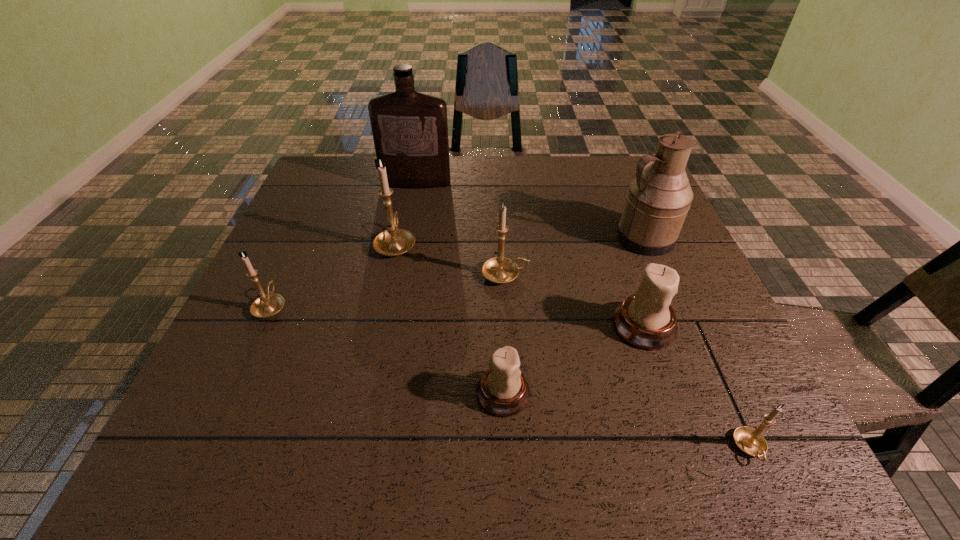
What are the coordinates of `the seventh farthest object` in the screenshot? It's located at (503, 391).

This screenshot has height=540, width=960. I want to click on the nearer white candle holder, so click(503, 391).

Identify the location of the rightmost gold candle holder. (751, 441).

I want to click on the nearest candle holder, so click(751, 441).

Locate an element on the screen. The image size is (960, 540). free location located 0.310m on the label side of the liquor is located at coordinates (401, 258).

This screenshot has height=540, width=960. In order to click on free space located 0.280m on the left of the pitcher in this screenshot , I will do `click(507, 238)`.

I want to click on free space located 0.250m on the handle side of the sixth shortest object, so click(410, 178).

Locate an element on the screen. This screenshot has height=540, width=960. vacant space located 0.270m on the handle side of the sixth shortest object is located at coordinates (411, 174).

This screenshot has height=540, width=960. I want to click on blank space located on the handle side of the sixth shortest object, so click(x=413, y=163).

At what (x,y) coordinates should I click in order to perform the action: click on free point located on the handle side of the third smallest gold candle holder. Please return your answer as a coordinate pair (x, y). Looking at the image, I should click on (592, 275).